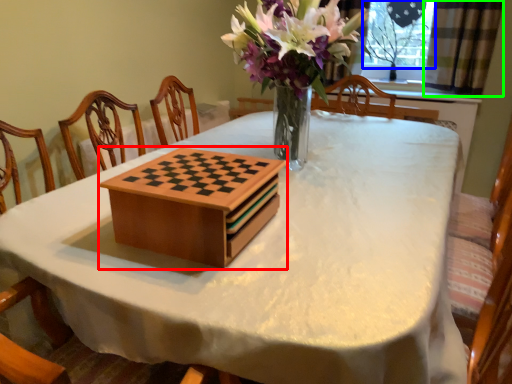
Question: Which object is positioned closest to cardboard box (highlighted by a red box)? Select from window screen (highlighted by a blue box) and curtain (highlighted by a green box).

Choices:
 (A) window screen
 (B) curtain

Answer: (B)